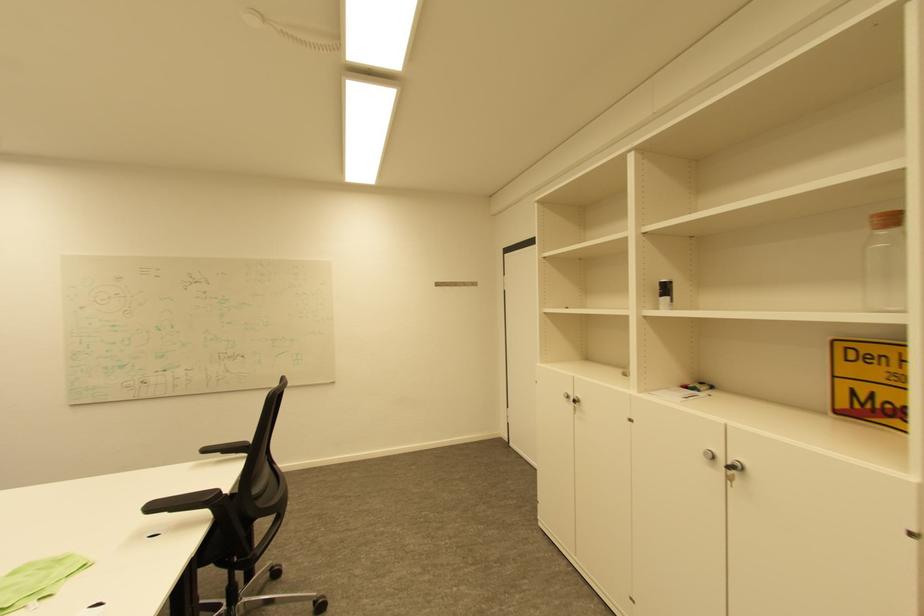
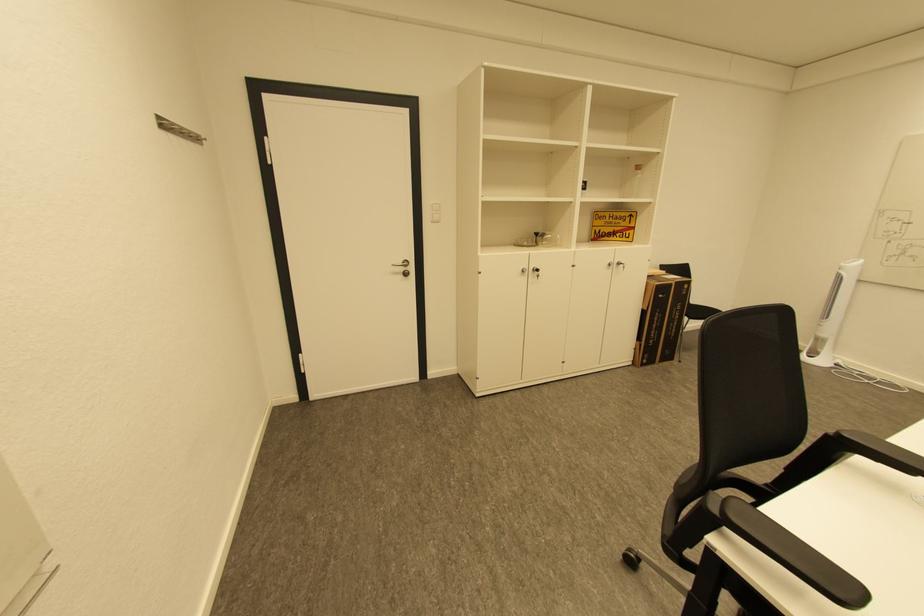
The point at (869, 398) is marked in the first image. Where is the corresponding point in the second image?

(603, 233)